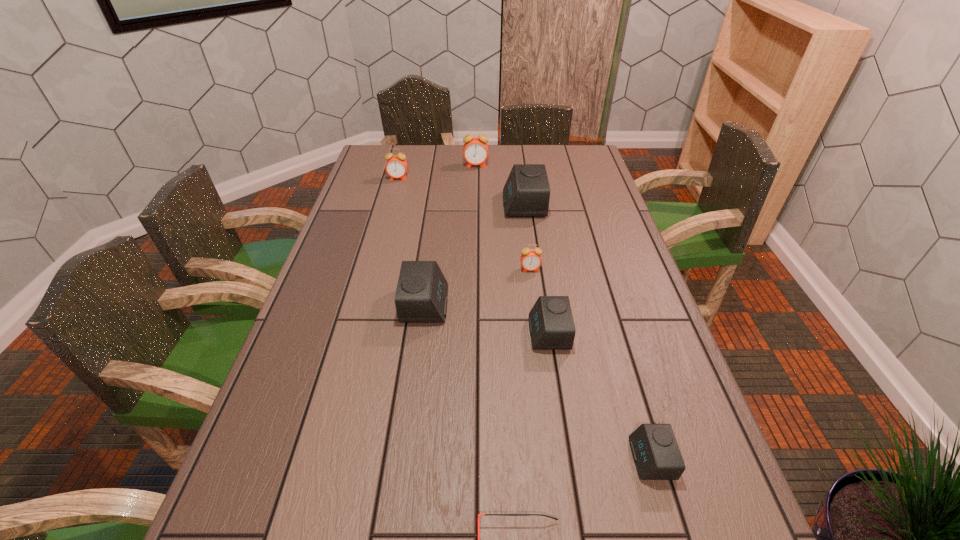
Where is `free space located on the front-facing side of the third biggest black alarm clock`? Image resolution: width=960 pixels, height=540 pixels. free space located on the front-facing side of the third biggest black alarm clock is located at coordinates (493, 333).

Where is `blank space located 0.290m on the front-facing side of the third biggest black alarm clock`? The height and width of the screenshot is (540, 960). blank space located 0.290m on the front-facing side of the third biggest black alarm clock is located at coordinates (414, 333).

At what (x,y) coordinates should I click in order to perform the action: click on vacant space located on the front-facing side of the third biggest black alarm clock. Please return your answer as a coordinate pair (x, y). The width and height of the screenshot is (960, 540). Looking at the image, I should click on (371, 333).

What are the coordinates of `vacant region located on the front-facing side of the nearest black alarm clock` in the screenshot? It's located at (537, 459).

Image resolution: width=960 pixels, height=540 pixels. I want to click on vacant region located on the front-facing side of the nearest black alarm clock, so click(x=460, y=459).

Locate an element on the screen. free space located on the front-facing side of the nearest black alarm clock is located at coordinates (430, 459).

Locate an element on the screen. object positioned at the far edge is located at coordinates (475, 151).

At what (x,y) coordinates should I click in order to perform the action: click on object positioned at the left edge. Please return your answer as a coordinate pair (x, y). The image size is (960, 540). Looking at the image, I should click on point(396,166).

The image size is (960, 540). What are the coordinates of `object located at the right edge` in the screenshot? It's located at (656, 453).

You are a GUI agent. You are given a task and a screenshot of the screen. Output one action in this format:
    pyautogui.click(x=<x>, y=<y>)
    Task: Click on the vacant space at the far edge of the desktop
    This screenshot has height=540, width=960.
    Given the screenshot: What is the action you would take?
    pyautogui.click(x=421, y=170)